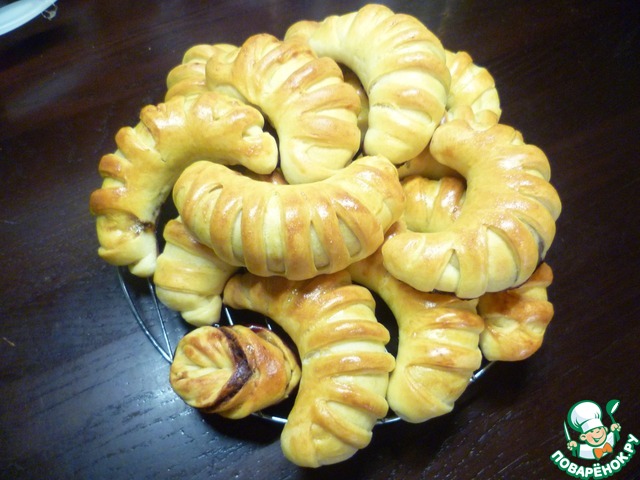
In order to click on chef's apron in this screenshot , I will do `click(585, 448)`.